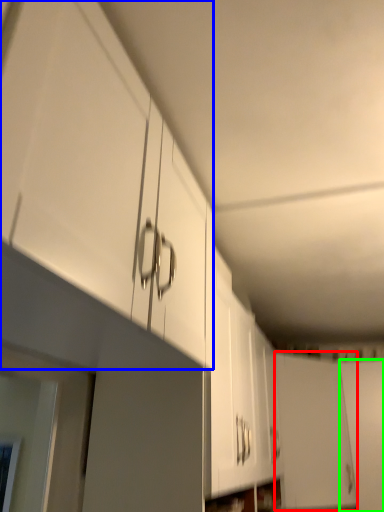
Question: Considering the real-world distances, which object is farthest from door (highlighted by a red box)? cabinetry (highlighted by a blue box) or door (highlighted by a green box)?

Choices:
 (A) cabinetry
 (B) door

Answer: (A)